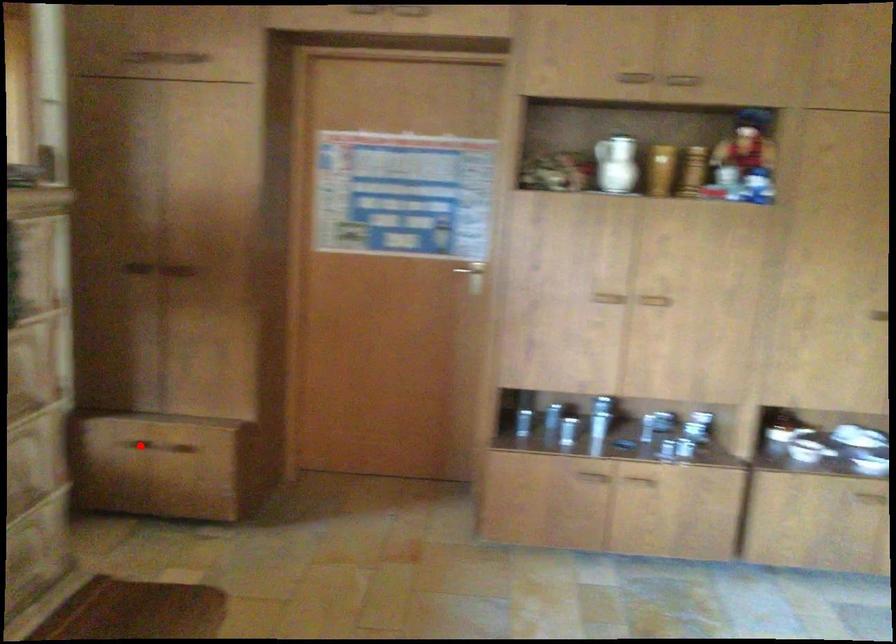
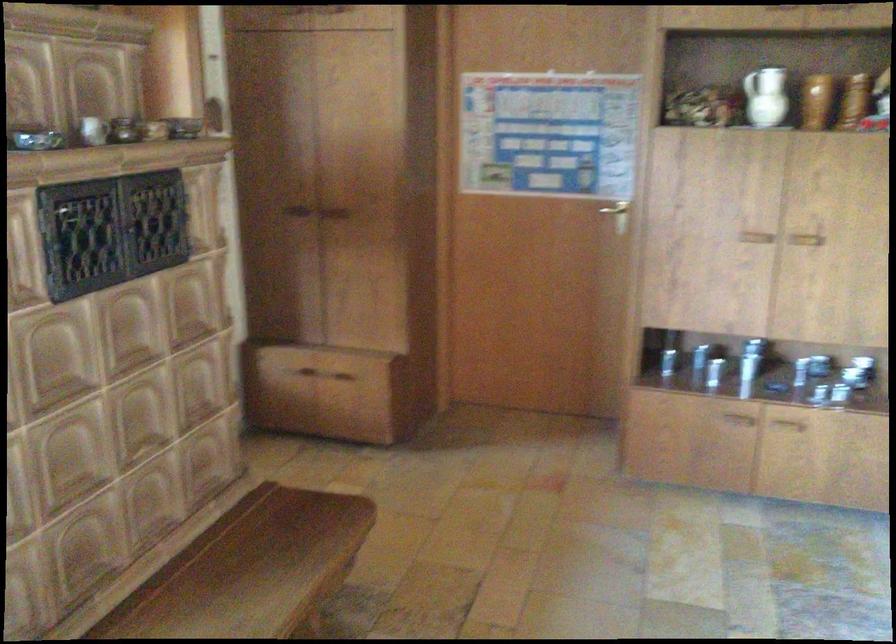
Where in the second image is the point corresponding to the highlighted location from the first image?

(303, 375)